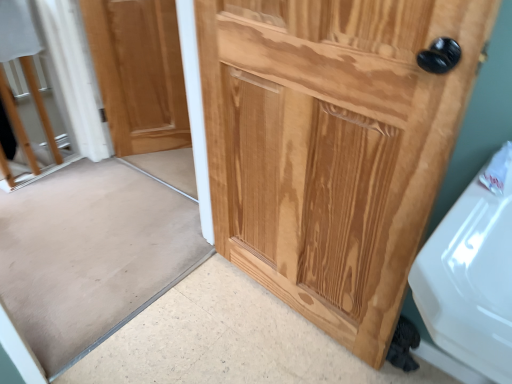
This screenshot has width=512, height=384. Find the location of `free space in front of natural wood door at right, positioned as the 2th door in left-to-right order`. free space in front of natural wood door at right, positioned as the 2th door in left-to-right order is located at coordinates (276, 352).